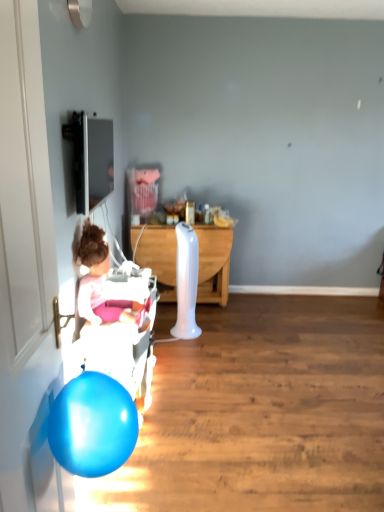
Question: From a real-world perspective, is white glossy door at left over white wood desk at center?

Choices:
 (A) yes
 (B) no

Answer: (A)

Question: Is white glossy door at left located outside white wood desk at center?

Choices:
 (A) yes
 (B) no

Answer: (A)

Question: Does white glossy door at left come behind white wood desk at center?

Choices:
 (A) yes
 (B) no

Answer: (B)

Question: Would you say white glossy door at left is a long distance from white wood desk at center?

Choices:
 (A) no
 (B) yes

Answer: (B)

Question: From a real-world perspective, is white glossy door at left positioned under white wood desk at center based on gravity?

Choices:
 (A) yes
 (B) no

Answer: (B)

Question: Can you see white glossy door at left touching white wood desk at center?

Choices:
 (A) no
 (B) yes

Answer: (A)

Question: From the image's perspective, is white glossy door at left below white plastic baby carriage at left?

Choices:
 (A) no
 (B) yes

Answer: (A)

Question: Does white glossy door at left have a lesser width compared to white plastic baby carriage at left?

Choices:
 (A) yes
 (B) no

Answer: (A)

Question: Is white glossy door at left outside of white plastic baby carriage at left?

Choices:
 (A) no
 (B) yes

Answer: (B)

Question: Is white glossy door at left wider than white plastic baby carriage at left?

Choices:
 (A) no
 (B) yes

Answer: (A)

Question: Is white glossy door at left taller than white plastic baby carriage at left?

Choices:
 (A) no
 (B) yes

Answer: (B)

Question: From a real-world perspective, is white glossy door at left on top of white plastic baby carriage at left?

Choices:
 (A) yes
 (B) no

Answer: (A)

Question: Is pink fabric at left outside white wood desk at center?

Choices:
 (A) yes
 (B) no

Answer: (A)